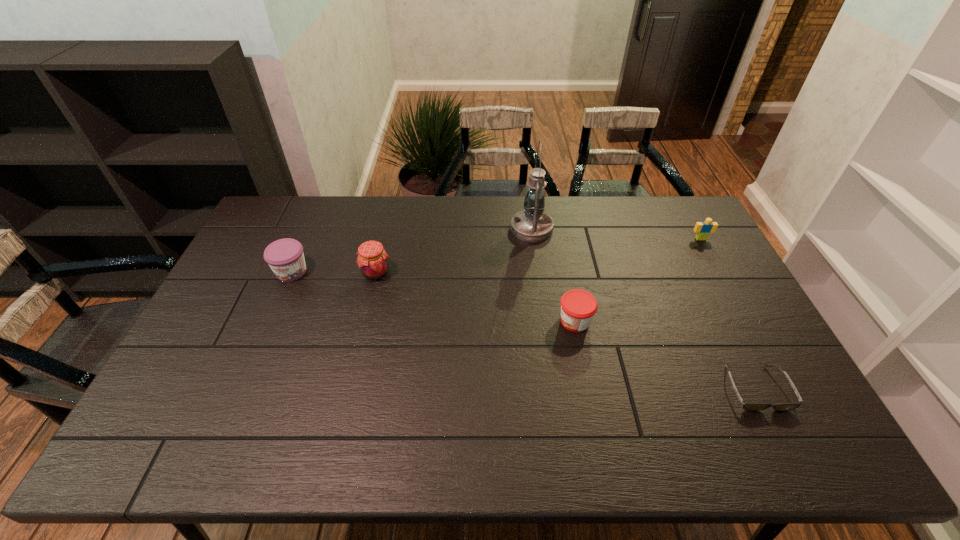
The image size is (960, 540). Identify the location of free space between the Lego and the rightmost jam. coord(637,280).

Find the location of a particular element. The width and height of the screenshot is (960, 540). vacant point located between the shortest object and the tallest object is located at coordinates (644, 308).

Locate an element on the screen. unoccupied position between the rightmost jam and the leftmost jam is located at coordinates (433, 296).

The height and width of the screenshot is (540, 960). Identify the location of free point between the shortest object and the Lego. (729, 313).

Identify which object is the second nearest to the leftmost jam. Please provide its 2D coordinates. Your answer should be formatted as a tuple, i.e. [(x, y)], where the tuple contains the x and y coordinates of a point satisfying the conditions above.

[(532, 224)]

Locate an element on the screen. The height and width of the screenshot is (540, 960). the fifth closest object to the Lego is located at coordinates (285, 257).

At what (x,y) coordinates should I click in order to perform the action: click on jam that is the third closest to the Lego. Please return your answer as a coordinate pair (x, y). Image resolution: width=960 pixels, height=540 pixels. Looking at the image, I should click on (285, 257).

Find the location of a particular element. This screenshot has height=540, width=960. jam that stands as the third closest to the Lego is located at coordinates (285, 257).

Where is `blank space that satisfies the following two spatial constraints: 1. on the front label of the leftmost object; 2. on the left side of the fifth object from right to left`? This screenshot has height=540, width=960. blank space that satisfies the following two spatial constraints: 1. on the front label of the leftmost object; 2. on the left side of the fifth object from right to left is located at coordinates (291, 273).

Locate an element on the screen. The image size is (960, 540). vacant space that satisfies the following two spatial constraints: 1. on the back side of the oil lamp; 2. on the right side of the fifth object from right to left is located at coordinates (387, 228).